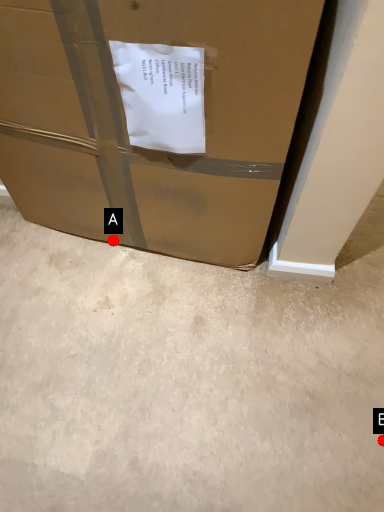
Question: Two points are circled on the image, labeled by A and B beside each circle. Which point is closer to the camera taking this photo?

Choices:
 (A) A is closer
 (B) B is closer

Answer: (B)